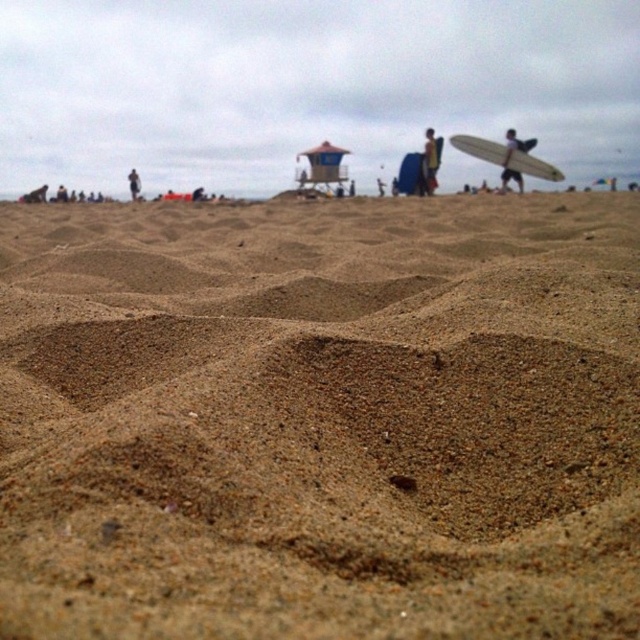
What do you see at coordinates (321, 419) in the screenshot? This screenshot has height=640, width=640. I see `fine-grained sand at center` at bounding box center [321, 419].

In order to click on fine-grained sand at center in this screenshot , I will do `click(321, 419)`.

Between white matte surfboard at upper right and matte black surfboard at right, which one has less height?

Standing shorter between the two is matte black surfboard at right.

Find the location of a particular element. This screenshot has width=640, height=640. white matte surfboard at upper right is located at coordinates (506, 156).

Between point (522, 177) and point (131, 188), which one is positioned in front?

Point (131, 188) is more forward.

You are a GUI agent. You are given a task and a screenshot of the screen. Output one action in this format:
    pyautogui.click(x=<x>, y=<y>)
    Task: Click on the smooth white surfboard at right
    
    Given the screenshot: What is the action you would take?
    pyautogui.click(x=509, y=156)